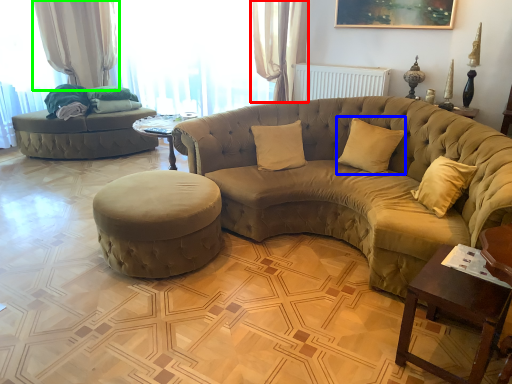
Question: Which object is the closest to the curtain (highlighted by a red box)? Choose among these: pillow (highlighted by a blue box) or curtain (highlighted by a green box).

Choices:
 (A) pillow
 (B) curtain

Answer: (A)